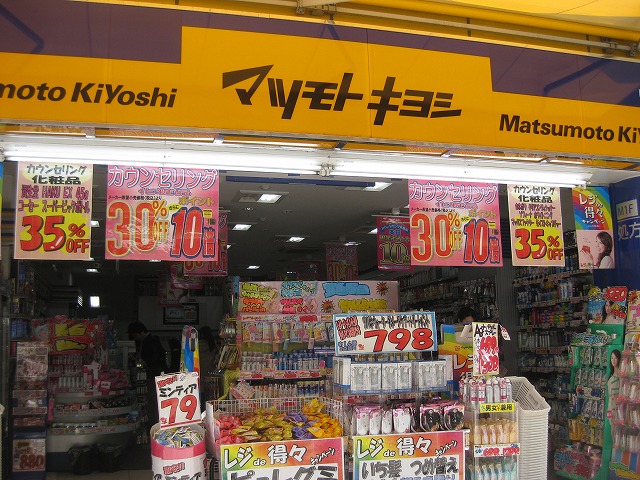
The width and height of the screenshot is (640, 480). I want to click on light, so click(x=385, y=192), click(x=372, y=233), click(x=347, y=250), click(x=301, y=243), click(x=242, y=234), click(x=274, y=196), click(x=253, y=273), click(x=92, y=266), click(x=89, y=214), click(x=77, y=306).